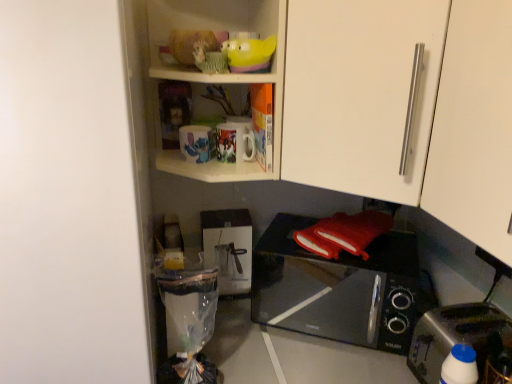
Question: From a real-world perspective, is white matte cabinet door at upper right, which is the 2th cabinetry in front-to-back order, above or below black glossy microwave oven at lower center?

Choices:
 (A) below
 (B) above

Answer: (B)

Question: Does point (362, 117) appear closer or farther from the camera than point (288, 278)?

Choices:
 (A) closer
 (B) farther

Answer: (A)

Question: Which object is the closest to the black glossy microwave oven at lower center?

Choices:
 (A) white matte cabinet door at upper right, which is the 2th cabinetry in front-to-back order
 (B) translucent yellow bowl at upper center
 (C) white plastic bottle at lower right
 (D) matte ceramic mugs at upper center
 (E) white matte door at left

Answer: (A)

Question: Which of these objects is positioned closest to the white matte cabinet door at upper right, which is the 2th cabinetry in front-to-back order?

Choices:
 (A) translucent yellow bowl at upper center
 (B) white matte cabinet handle at upper right, placed as the 1th cabinetry when sorted from front to back
 (C) matte ceramic mugs at upper center
 (D) black glossy microwave oven at lower center
 (E) white matte door at left

Answer: (B)